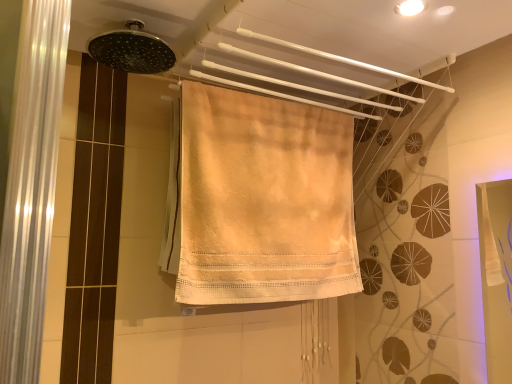
Question: Should I look upward or downward to see beige cotton towel at center?

Choices:
 (A) down
 (B) up

Answer: (A)

Question: Is matte black shower head at upper center directly adjacent to beige cotton towel at center?

Choices:
 (A) yes
 (B) no

Answer: (B)

Question: Considering the relative positions of matte black shower head at upper center and beige cotton towel at center in the image provided, is matte black shower head at upper center behind beige cotton towel at center?

Choices:
 (A) no
 (B) yes

Answer: (A)

Question: From a real-world perspective, is matte black shower head at upper center on top of beige cotton towel at center?

Choices:
 (A) no
 (B) yes

Answer: (B)

Question: From the image's perspective, is matte black shower head at upper center below beige cotton towel at center?

Choices:
 (A) no
 (B) yes

Answer: (A)

Question: Is matte black shower head at upper center positioned in front of beige cotton towel at center?

Choices:
 (A) no
 (B) yes

Answer: (B)

Question: Can you confirm if matte black shower head at upper center is wider than beige cotton towel at center?

Choices:
 (A) yes
 (B) no

Answer: (A)

Question: Is beige cotton towel at center to the left of matte black shower head at upper center from the viewer's perspective?

Choices:
 (A) no
 (B) yes

Answer: (A)

Question: Is the depth of beige cotton towel at center greater than that of matte black shower head at upper center?

Choices:
 (A) yes
 (B) no

Answer: (A)

Question: Is beige cotton towel at center smaller than matte black shower head at upper center?

Choices:
 (A) no
 (B) yes

Answer: (A)

Question: Is beige cotton towel at center positioned before matte black shower head at upper center?

Choices:
 (A) no
 (B) yes

Answer: (A)

Question: Can you confirm if beige cotton towel at center is thinner than matte black shower head at upper center?

Choices:
 (A) no
 (B) yes

Answer: (B)

Question: Can you confirm if beige cotton towel at center is wider than matte black shower head at upper center?

Choices:
 (A) no
 (B) yes

Answer: (A)

Question: Is point coord(247,284) positioned closer to the camera than point coord(100,51)?

Choices:
 (A) farther
 (B) closer

Answer: (A)